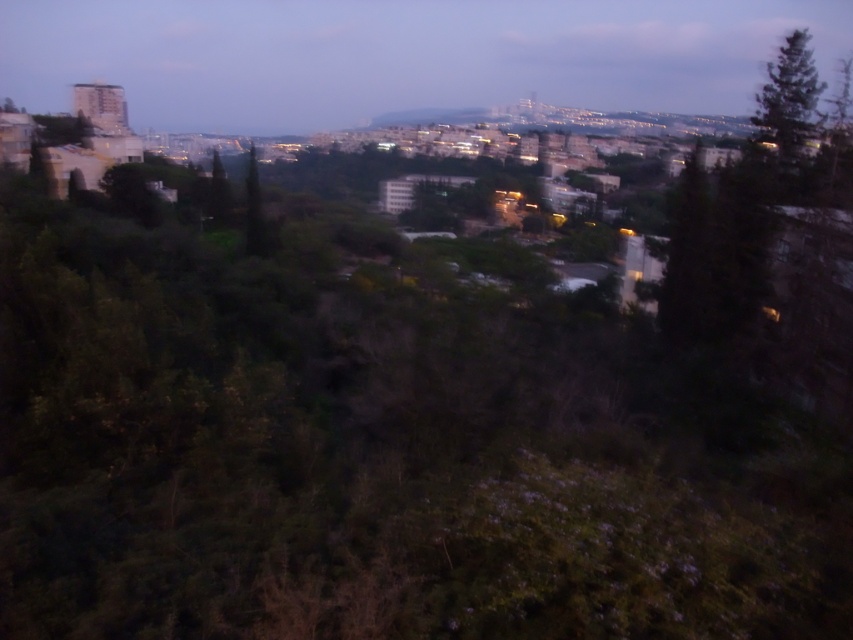
You are a landscape architect planning to add a new pathway between the green textured tree at upper right and the green leafy tree at center. Considering their widths, which tree will require more space to avoid encroaching on the pathway?

The green leafy tree at center has a greater width than the green textured tree at upper right, so it will require more space to avoid encroaching on the pathway.

You are a city planner analyzing the urban green space. You see the green textured tree at upper right and the green leafy tree at center in the image. Which tree would be more suitable for shading a pedestrian walkway based on their sizes?

The green leafy tree at center is larger than the green textured tree at upper right, making it more suitable for shading a pedestrian walkway due to its greater size.